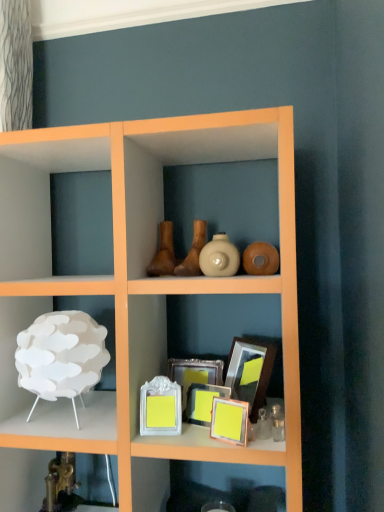
Question: From the image's perspective, does matte brown vase at center, the third vase in the right-to-left sequence, appear higher than white matte lamp at left, which ranks as the second shelf in bottom-to-top order?

Choices:
 (A) no
 (B) yes

Answer: (B)

Question: Is matte brown vase at center, arranged as the first vase when viewed from the left, surrounding white matte lamp at left, which ranks as the second shelf in bottom-to-top order?

Choices:
 (A) yes
 (B) no

Answer: (B)

Question: Does matte brown vase at center, the third vase in the right-to-left sequence, have a larger size compared to white matte lamp at left, which is counted as the first shelf, starting from the top?

Choices:
 (A) no
 (B) yes

Answer: (A)

Question: Can you confirm if matte brown vase at center, the third vase in the right-to-left sequence, is positioned to the right of white matte lamp at left, which ranks as the second shelf in bottom-to-top order?

Choices:
 (A) yes
 (B) no

Answer: (A)

Question: Is matte brown vase at center, arranged as the first vase when viewed from the left, outside of white matte lamp at left, which is counted as the first shelf, starting from the top?

Choices:
 (A) no
 (B) yes

Answer: (B)

Question: Considering the relative positions of wooden picture frame at center, marked as the 1th picture frame in a back-to-front arrangement, and brown matte vase at center, the second vase when ordered from left to right, in the image provided, is wooden picture frame at center, marked as the 1th picture frame in a back-to-front arrangement, to the left or to the right of brown matte vase at center, the second vase when ordered from left to right,?

Choices:
 (A) left
 (B) right

Answer: (B)

Question: Relative to brown matte vase at center, the second vase when ordered from left to right, is wooden picture frame at center, arranged as the 4th picture frame when viewed from the front, in front or behind?

Choices:
 (A) front
 (B) behind

Answer: (B)

Question: From the image's perspective, is wooden picture frame at center, arranged as the 4th picture frame when viewed from the front, positioned above or below brown matte vase at center, the second vase when ordered from left to right?

Choices:
 (A) above
 (B) below

Answer: (B)

Question: From a real-world perspective, is wooden picture frame at center, marked as the 1th picture frame in a back-to-front arrangement, positioned above or below brown matte vase at center, the second vase when ordered from left to right?

Choices:
 (A) below
 (B) above

Answer: (A)

Question: From the image's perspective, is metallic gold faucet at lower left, acting as the first shelf starting from the bottom, above or below white glossy picture frame at center, the second picture frame from the front?

Choices:
 (A) below
 (B) above

Answer: (A)

Question: In terms of width, does metallic gold faucet at lower left, acting as the first shelf starting from the bottom, look wider or thinner when compared to white glossy picture frame at center, which is the third picture frame from back to front?

Choices:
 (A) thin
 (B) wide

Answer: (B)

Question: Is metallic gold faucet at lower left, acting as the first shelf starting from the bottom, to the left or to the right of white glossy picture frame at center, the second picture frame from the front, in the image?

Choices:
 (A) right
 (B) left

Answer: (B)

Question: In terms of size, does metallic gold faucet at lower left, acting as the first shelf starting from the bottom, appear bigger or smaller than white glossy picture frame at center, which is the third picture frame from back to front?

Choices:
 (A) big
 (B) small

Answer: (A)

Question: Is point (24, 392) positioned closer to the camera than point (213, 409)?

Choices:
 (A) farther
 (B) closer

Answer: (A)

Question: Considering the positions of white matte lamp at left, which ranks as the second shelf in bottom-to-top order, and matte yellow picture frame at center, which appears as the 1th picture frame when viewed from the front, in the image, is white matte lamp at left, which ranks as the second shelf in bottom-to-top order, wider or thinner than matte yellow picture frame at center, which appears as the 1th picture frame when viewed from the front,?

Choices:
 (A) wide
 (B) thin

Answer: (A)